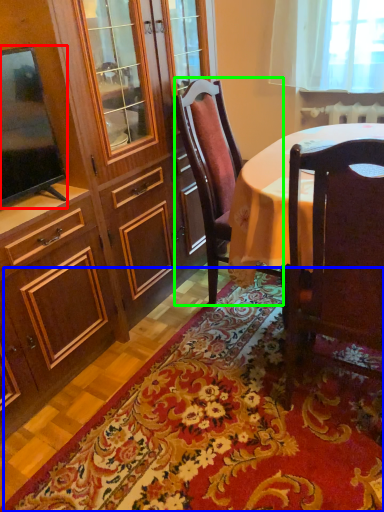
Question: Which object is positioned closest to television (highlighted by a red box)? Select from mat (highlighted by a blue box) and chair (highlighted by a green box).

Choices:
 (A) mat
 (B) chair

Answer: (B)